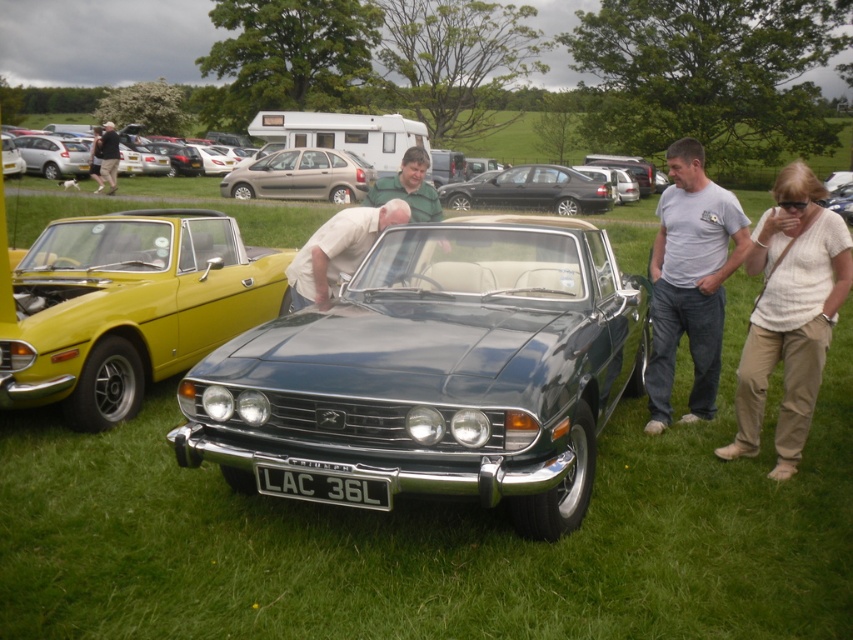
Is point (329, 388) positioned before point (689, 154)?

Yes.

Locate an element on the screen. shiny metallic car at center is located at coordinates (438, 371).

What do you see at coordinates (438, 371) in the screenshot? This screenshot has width=853, height=640. I see `shiny metallic car at center` at bounding box center [438, 371].

Locate an element on the screen. shiny metallic car at center is located at coordinates (438, 371).

Between satin silver car at center and dark gray shirt at upper left, which one has more height?

Standing taller between the two is dark gray shirt at upper left.

Which is more to the left, satin silver car at center or dark gray shirt at upper left?

dark gray shirt at upper left is more to the left.

Find the location of a particular element. This screenshot has height=640, width=853. satin silver car at center is located at coordinates (612, 180).

This screenshot has height=640, width=853. I want to click on satin silver car at center, so click(x=612, y=180).

Is white textured shirt at right closer to the viewer compared to matte yellow car at left?

Yes, white textured shirt at right is in front of matte yellow car at left.

Between point (822, 342) and point (13, 161), which one is positioned in front?

Point (822, 342) is more forward.

This screenshot has width=853, height=640. Identify the location of white textured shirt at right. (788, 314).